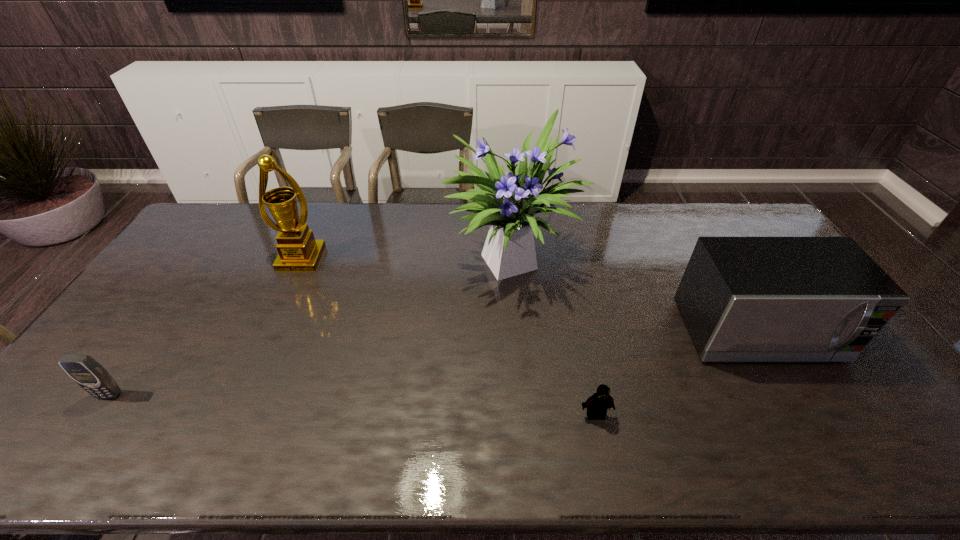
Find the location of a particular element. free spot located 0.340m on the front-facing side of the award is located at coordinates (257, 356).

The image size is (960, 540). I want to click on vacant space located with the door open on the rightmost object, so click(x=819, y=435).

You are a GUI agent. You are given a task and a screenshot of the screen. Output one action in this format:
    pyautogui.click(x=<x>, y=<y>)
    Task: Click on the free region located 0.060m on the front face of the second shortest object
    Image resolution: width=960 pixels, height=540 pixels.
    Given the screenshot: What is the action you would take?
    (x=90, y=422)

I want to click on free location located on the face of the Lego, so pyautogui.click(x=602, y=445).

You are a GUI agent. You are given a task and a screenshot of the screen. Output one action in this format:
    pyautogui.click(x=<x>, y=<y>)
    Task: Click on the object that is positioned at the far edge
    This screenshot has height=540, width=960.
    Given the screenshot: What is the action you would take?
    pyautogui.click(x=508, y=205)

This screenshot has width=960, height=540. In order to click on object at the left edge in this screenshot , I will do `click(83, 369)`.

Image resolution: width=960 pixels, height=540 pixels. Identify the location of object that is at the right edge. (743, 299).

Where is `vacant space at the far edge of the desktop`? The height and width of the screenshot is (540, 960). vacant space at the far edge of the desktop is located at coordinates (608, 202).

Where is `vacant space at the near edge of the desktop`? This screenshot has width=960, height=540. vacant space at the near edge of the desktop is located at coordinates (204, 457).

Where is `free space at the left edge of the desktop`? Image resolution: width=960 pixels, height=540 pixels. free space at the left edge of the desktop is located at coordinates (196, 258).